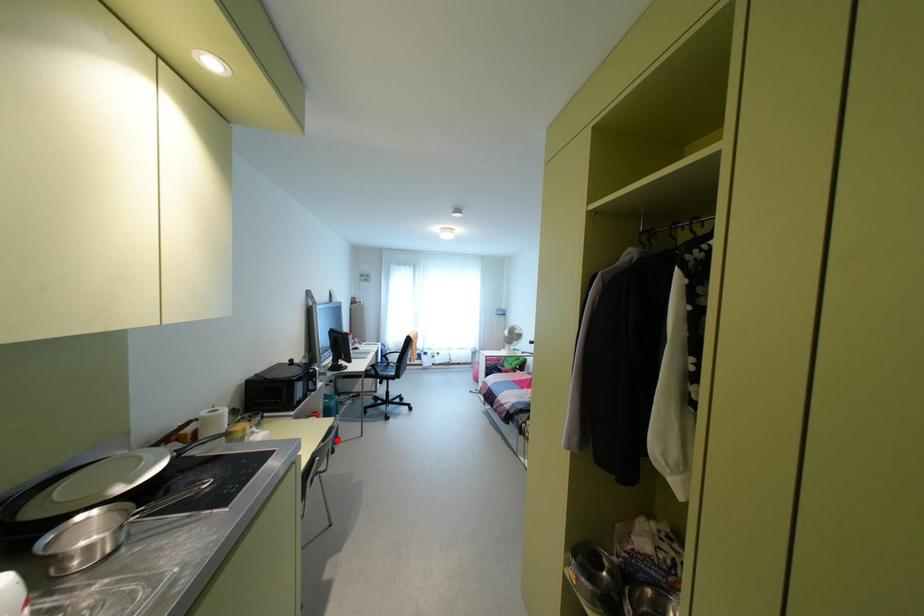
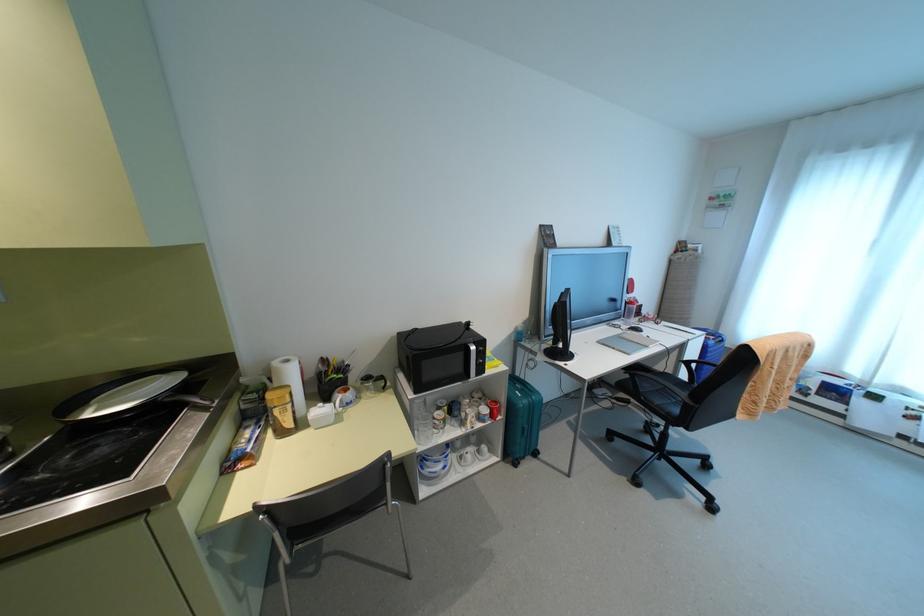
Find the pixel in the second image that matches the highlighted location in the first image.

(535, 454)